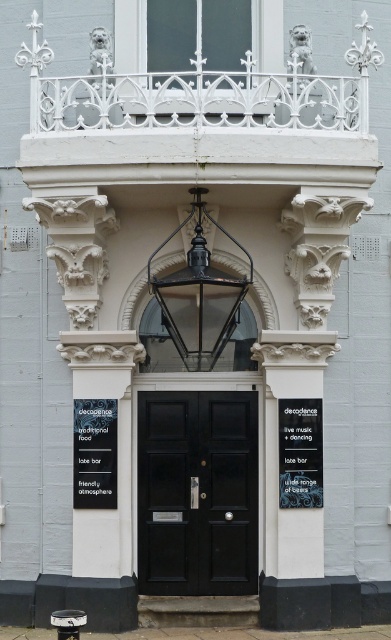
Is black matte signboard at center smaller than black paper at lower left?

Indeed, black matte signboard at center has a smaller size compared to black paper at lower left.

Is black matte signboard at center further to camera compared to black paper at lower left?

No, it is not.

Image resolution: width=391 pixels, height=640 pixels. I want to click on black matte signboard at center, so click(x=299, y=452).

Looking at this image, between black matte door at center and black matte signboard at center, which one appears on the right side from the viewer's perspective?

Positioned to the right is black matte signboard at center.

Is black matte door at center closer to camera compared to black matte signboard at center?

No.

You are a GUI agent. You are given a task and a screenshot of the screen. Output one action in this format:
    pyautogui.click(x=<x>, y=<y>)
    Task: Click on the black matte door at center
    The width and height of the screenshot is (391, 640).
    Given the screenshot: What is the action you would take?
    pyautogui.click(x=197, y=492)

Find the location of a particular element. This screenshot has width=391, height=640. black matte door at center is located at coordinates (197, 492).

Identify the location of black matte door at center. The width and height of the screenshot is (391, 640). (197, 492).

Can you confirm if black matte door at center is taller than black paper at lower left?

Correct, black matte door at center is much taller as black paper at lower left.

Which is in front, point (211, 413) or point (96, 428)?

Point (96, 428)

Where is `black matte door at center`? The width and height of the screenshot is (391, 640). black matte door at center is located at coordinates (197, 492).